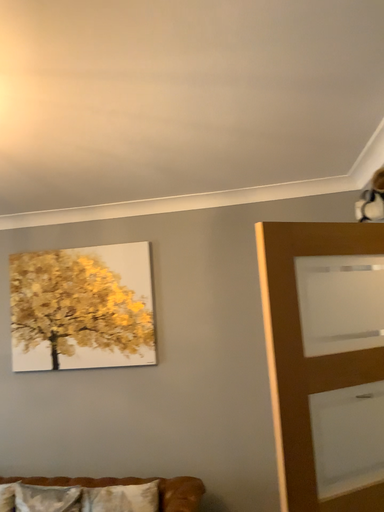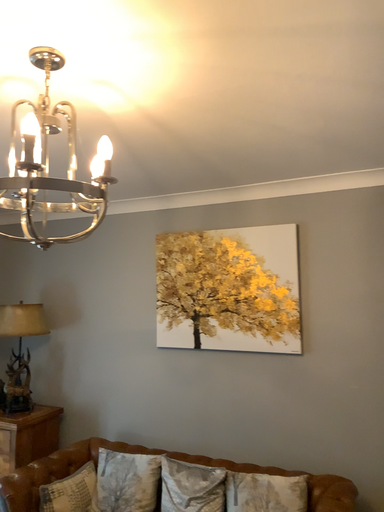
Question: Which way did the camera rotate in the video?

Choices:
 (A) rotated right
 (B) rotated left

Answer: (B)